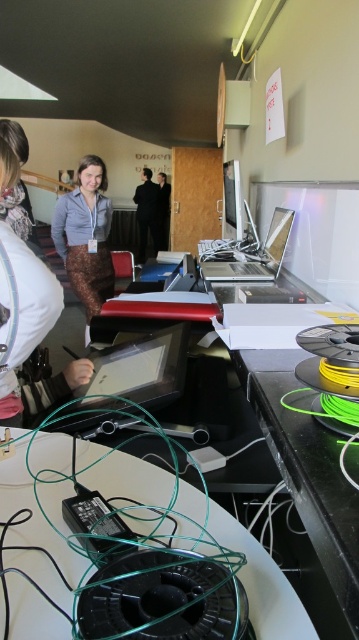
Does green wire at lower center have a larger size compared to silver metallic laptop at center?

No, green wire at lower center is not bigger than silver metallic laptop at center.

In the scene shown: Can you confirm if green wire at lower center is taller than silver metallic laptop at center?

No.

Is point (277, 632) farther from camera compared to point (216, 253)?

No.

Locate an element on the screen. green wire at lower center is located at coordinates (262, 582).

Between point (277, 250) and point (142, 211), which one is positioned in front?

Point (277, 250) is in front.

The width and height of the screenshot is (359, 640). I want to click on silver metallic laptop at center, so click(x=250, y=253).

Is point (225, 264) positioned in front of point (146, 202)?

Yes, point (225, 264) is closer to viewer.

Identify the location of silver metallic laptop at center. This screenshot has height=640, width=359. (250, 253).

Who is positioned more to the left, matte gray sweater at center or dark gray suit at center?

matte gray sweater at center is more to the left.

Is matte gray sweater at center taller than dark gray suit at center?

No, matte gray sweater at center is not taller than dark gray suit at center.

Is point (110, 289) farther from camera compared to point (164, 221)?

No.

This screenshot has width=359, height=640. What are the coordinates of `matte gray sweater at center` in the screenshot? It's located at (86, 236).